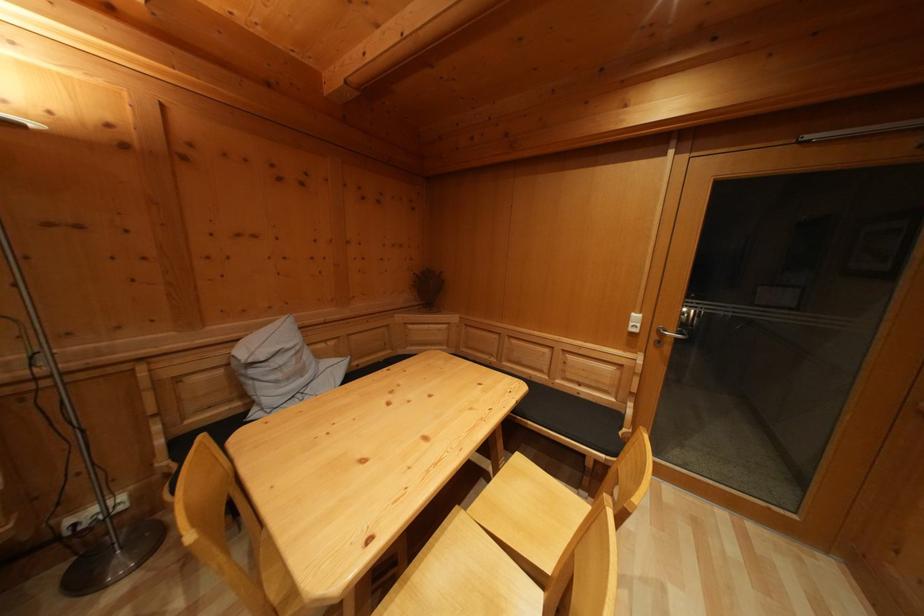
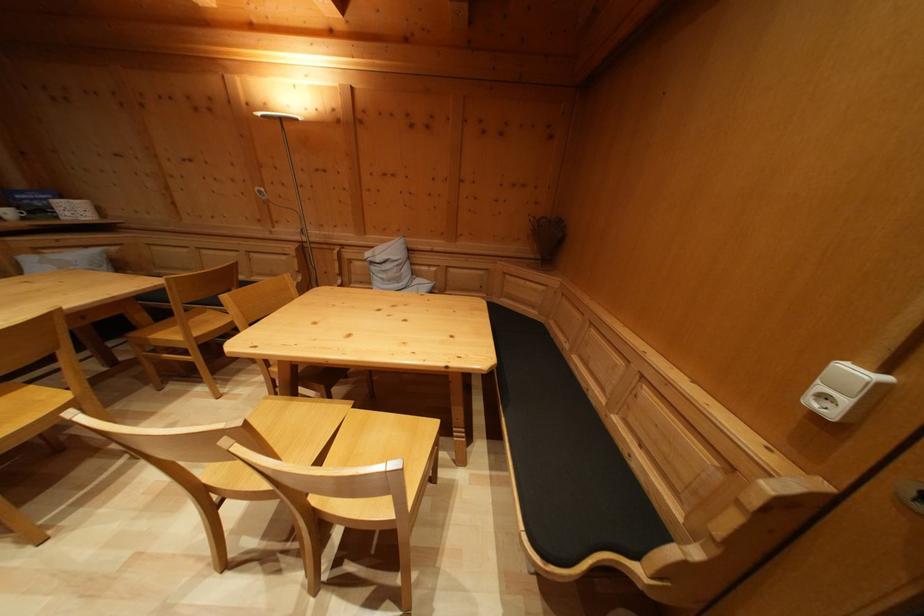
Locate, in the second image, the point that corresponds to [642,323] in the first image.

(859, 379)